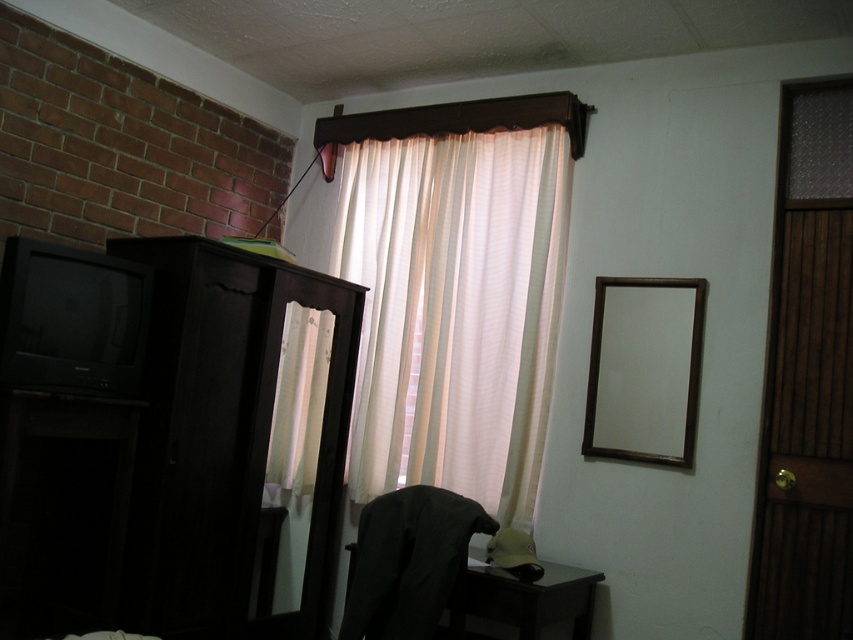
You are moving a tall plant into the room and need to place it near the dark wood dresser at left without blocking the white sheer curtain at upper center. Based on their heights, can the plant be placed in front of the dresser without obscuring the curtain?

The dark wood dresser at left has a lesser height compared to the white sheer curtain at upper center. Since the dresser is shorter, placing the tall plant in front of it might block the curtain if the plant is taller than the dresser. Ensure the plant is shorter than the dresser to avoid blocking the curtain.

You are a painter standing at the center of the room. You want to hang a new painting on the wall where the wooden frame mirror at upper right is currently located. The mirror is attached to the wall at the point marked by coordinates point (643, 369). If you want to hang your painting so that its center is exactly 10 cm below the mirror, what coordinates should you aim for?

The wooden frame mirror at upper right is located at point (643, 369). To hang the painting 10 cm below this point, you would need to adjust the y coordinate downward by 10 cm. The new coordinates would be point (643, 369) minus 0.1 in the y direction, resulting in point 0.578, 0.656.

In the scene shown: You are standing in the room and want to move from the wooden frame mirror at upper right to the dark fabric chair at lower center. Which direction should you move to reach the chair?

The wooden frame mirror at upper right is further to the viewer than the dark fabric chair at lower center, so you should move forward to reach the chair.